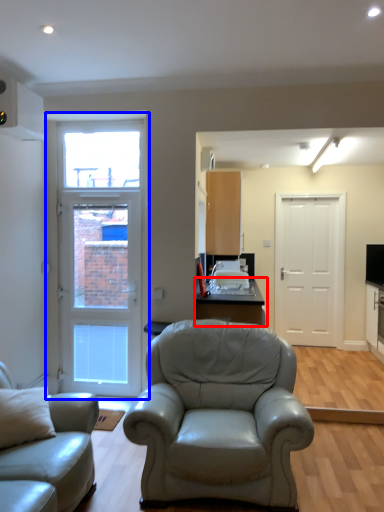
Question: Which object is further to the camera taking this photo, table (highlighted by a red box) or door (highlighted by a blue box)?

Choices:
 (A) table
 (B) door

Answer: (B)